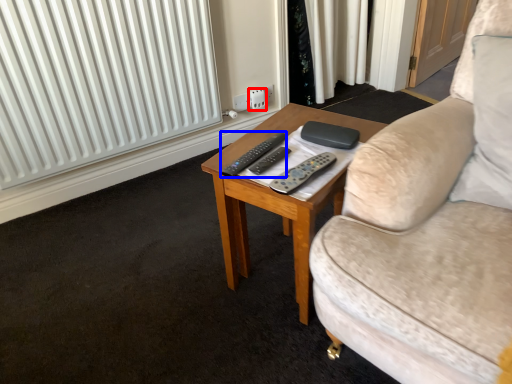
Question: Which object is closer to the camera taking this photo, electric outlet (highlighted by a red box) or remote control (highlighted by a blue box)?

Choices:
 (A) electric outlet
 (B) remote control

Answer: (B)